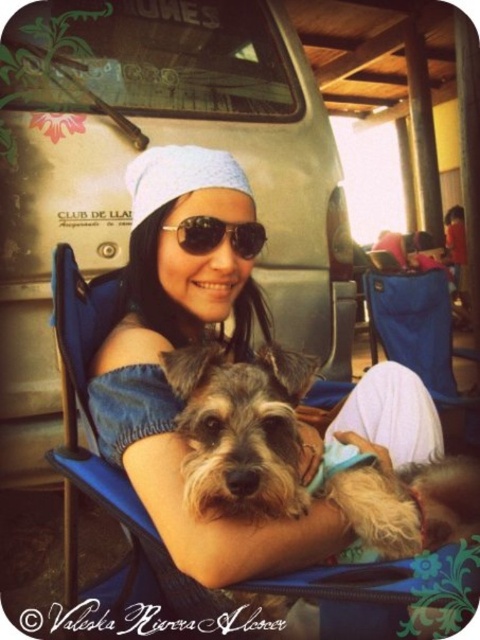
Question: Estimate the real-world distances between objects in this image. Which object is closer to the fuzzy brown dog at center?

Choices:
 (A) sunglasses at center
 (B) blue fabric folding chair at lower right
 (C) blue fabric chair at center

Answer: (C)

Question: Is blue fabric folding chair at lower right to the right of sunglasses at center from the viewer's perspective?

Choices:
 (A) yes
 (B) no

Answer: (A)

Question: Does fuzzy brown dog at center appear on the right side of blue fabric chair at center?

Choices:
 (A) no
 (B) yes

Answer: (B)

Question: Is blue fabric folding chair at lower right bigger than sunglasses at center?

Choices:
 (A) no
 (B) yes

Answer: (B)

Question: Based on their relative distances, which object is farther from the blue fabric chair at center?

Choices:
 (A) sunglasses at center
 (B) fuzzy brown dog at center

Answer: (A)

Question: Among these objects, which one is farthest from the camera?

Choices:
 (A) blue fabric folding chair at lower right
 (B) fuzzy brown dog at center
 (C) sunglasses at center

Answer: (A)